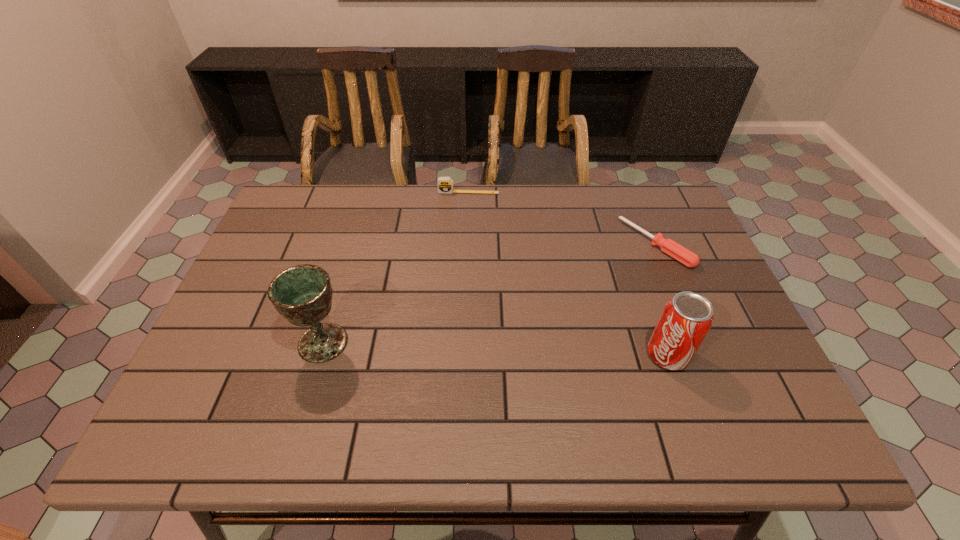
Find the location of a particular element. Image resolution: width=960 pixels, height=540 pixels. object positioned at the far right corner is located at coordinates (681, 254).

Where is `object that is positioned at the near right corner`? Image resolution: width=960 pixels, height=540 pixels. object that is positioned at the near right corner is located at coordinates (686, 319).

Find the location of a particular element. The width and height of the screenshot is (960, 540). vacant area at the far edge of the desktop is located at coordinates (550, 230).

This screenshot has height=540, width=960. In the image, there is a desktop. In order to click on free space at the near edge in this screenshot , I will do `click(424, 396)`.

In the image, there is a desktop. At what (x,y) coordinates should I click in order to perform the action: click on blank space at the left edge. Please return your answer as a coordinate pair (x, y). Looking at the image, I should click on (275, 333).

At what (x,y) coordinates should I click in order to perform the action: click on blank space at the right edge of the desktop. Please return your answer as a coordinate pair (x, y). Looking at the image, I should click on (686, 247).

In the image, there is a desktop. In order to click on vacant space at the far left corner in this screenshot , I will do `click(331, 192)`.

You are a GUI agent. You are given a task and a screenshot of the screen. Output one action in this format:
    pyautogui.click(x=<x>, y=<y>)
    Task: Click on the vacant space at the near left corner
    The image size is (960, 540).
    Given the screenshot: What is the action you would take?
    pyautogui.click(x=254, y=384)

Locate an element on the screen. The height and width of the screenshot is (540, 960). vacant area at the far right corner of the desktop is located at coordinates (648, 205).

In the image, there is a desktop. Find the location of `vacant space at the near right corner`. vacant space at the near right corner is located at coordinates (765, 388).